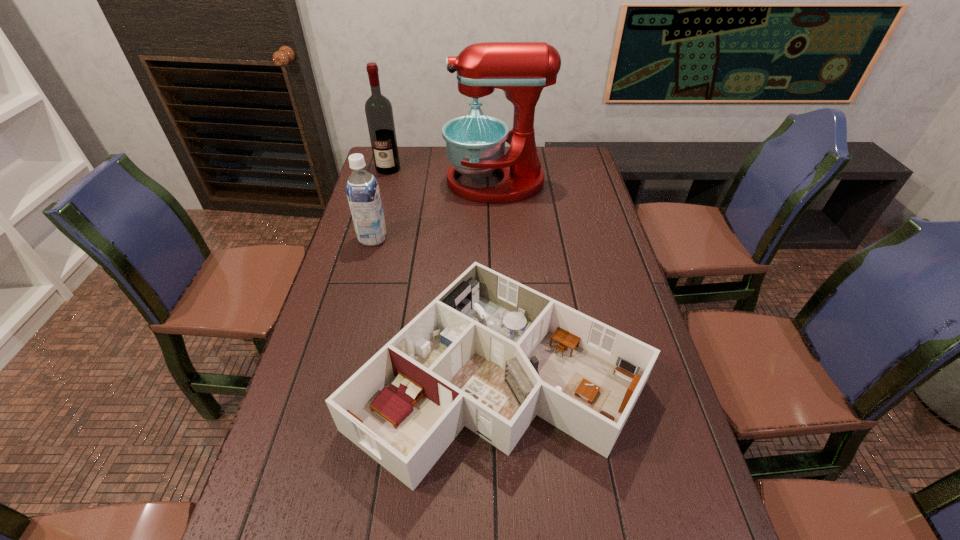
At what (x,y) coordinates should I click in order to perform the action: click on the tallest object. Please return your answer as a coordinate pair (x, y). The image size is (960, 540). Looking at the image, I should click on (475, 144).

You are a GUI agent. You are given a task and a screenshot of the screen. Output one action in this format:
    pyautogui.click(x=<x>, y=<y>)
    Task: Click on the alcohol
    This screenshot has width=960, height=540.
    Given the screenshot: What is the action you would take?
    pyautogui.click(x=379, y=114)

Identify the location of soya milk. Image resolution: width=960 pixels, height=540 pixels. (362, 189).

I want to click on the second nearest object, so click(x=362, y=189).

Where is `the nearest object`? The width and height of the screenshot is (960, 540). the nearest object is located at coordinates (489, 353).

Find the location of a particular element. the shortest object is located at coordinates (489, 353).

Find the location of `blank space located on the front-facing side of the mixer`. blank space located on the front-facing side of the mixer is located at coordinates (377, 182).

Find the location of a particular element. free space located 0.140m on the front-facing side of the mixer is located at coordinates (409, 182).

Find the location of a particular element. The image size is (960, 540). free spot located on the front-facing side of the mixer is located at coordinates (421, 182).

Locate an element on the screen. Image resolution: width=960 pixels, height=540 pixels. vacant space located 0.320m on the front and back of the alcohol is located at coordinates (372, 225).